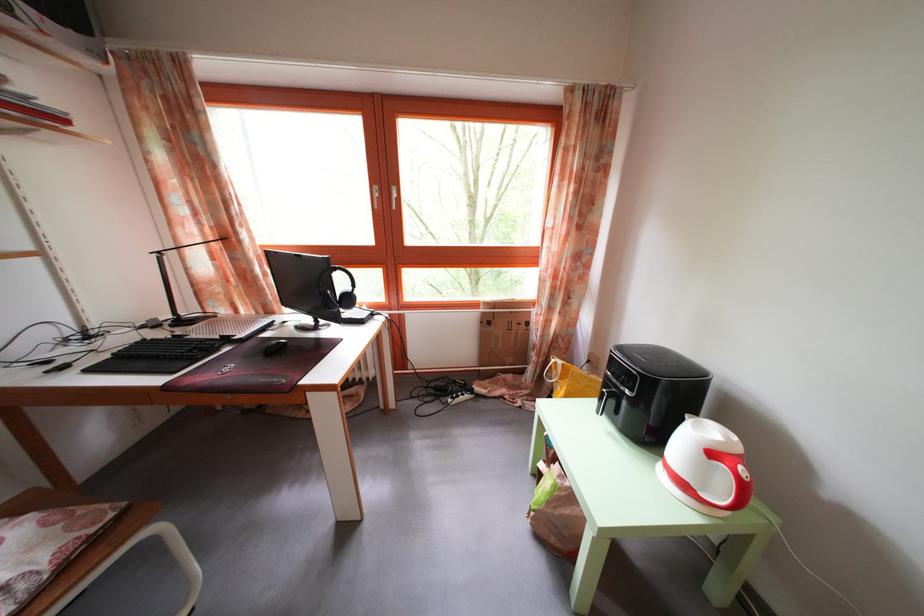
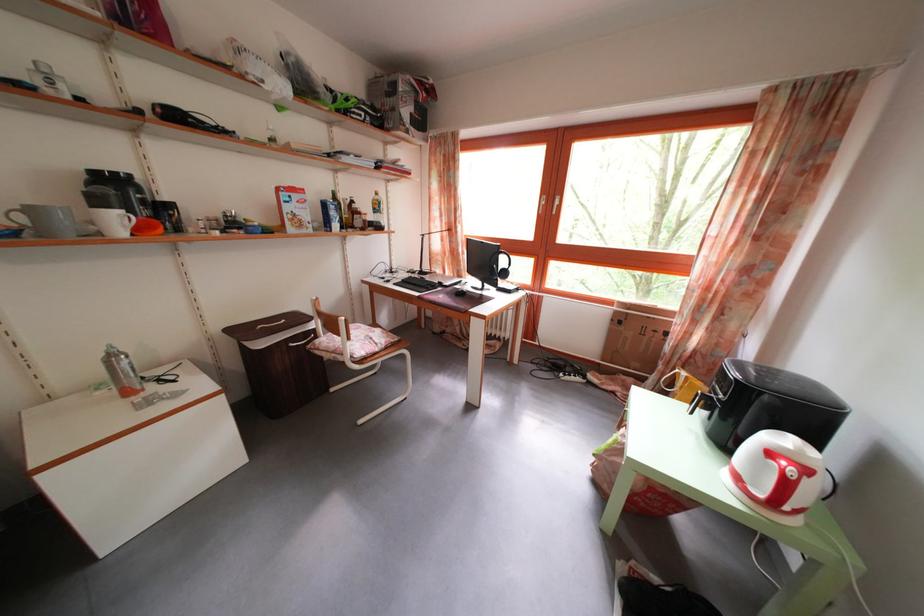
Where in the second image is the point corresponding to point (747, 464) from the first image?

(812, 477)